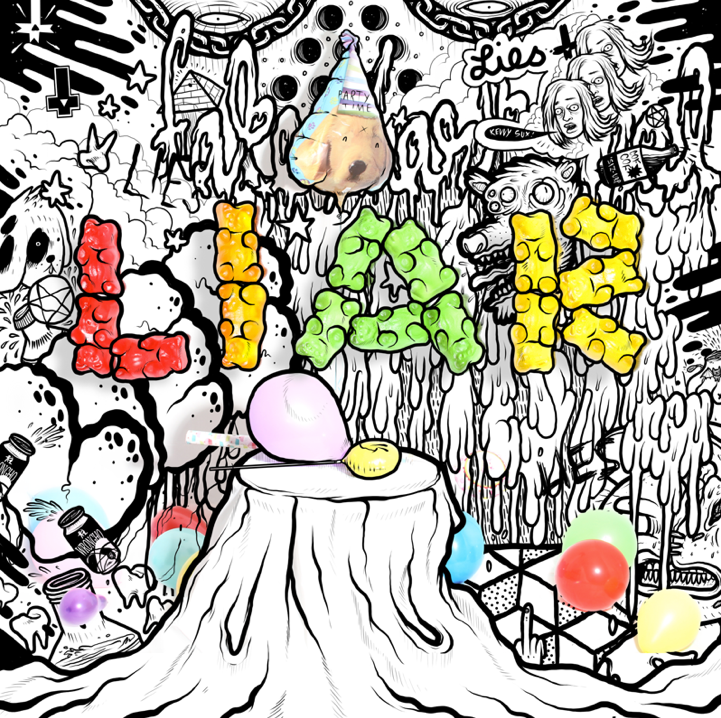
The height and width of the screenshot is (718, 721). I want to click on glass bottle, so click(x=632, y=164).